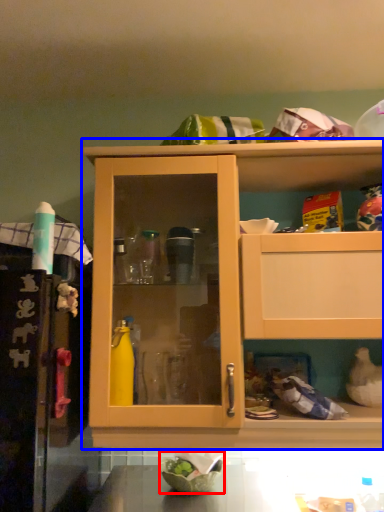
Question: Which object is further to the camera taking this photo, bowl (highlighted by a red box) or cabinetry (highlighted by a blue box)?

Choices:
 (A) bowl
 (B) cabinetry

Answer: (A)